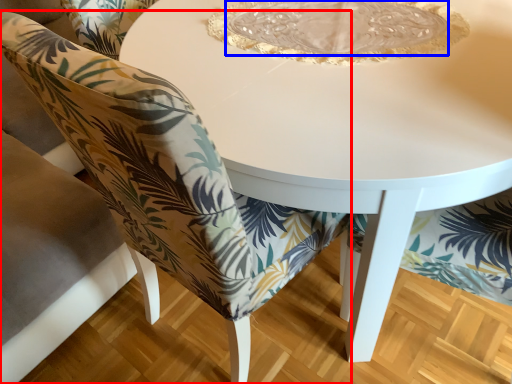
Question: Which point is closer to the camera, chair (highlighted by a red box) or glass plate (highlighted by a blue box)?

Choices:
 (A) chair
 (B) glass plate

Answer: (A)